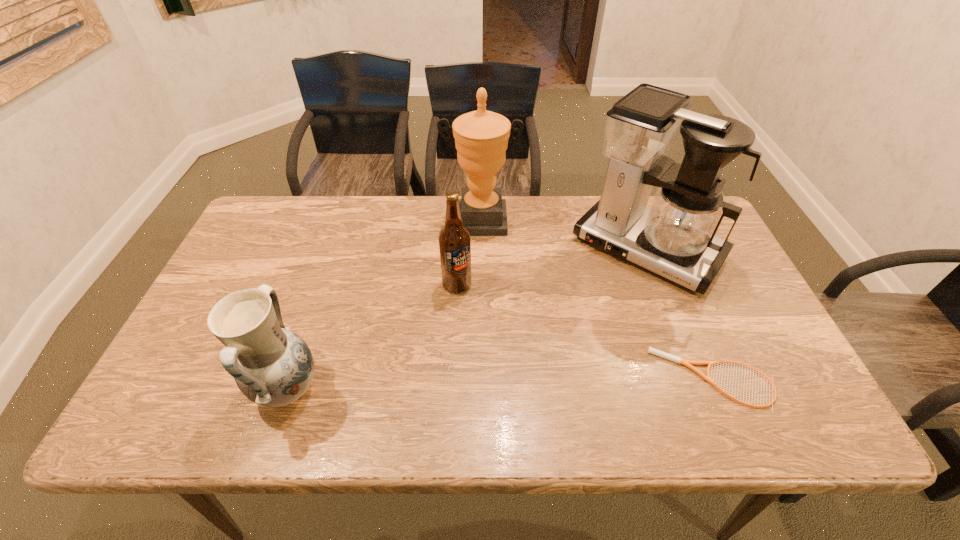
Where is `free spot located on the label of the beer bottle`? The image size is (960, 540). free spot located on the label of the beer bottle is located at coordinates (501, 369).

You are a GUI agent. You are given a task and a screenshot of the screen. Output one action in this format:
    pyautogui.click(x=<x>, y=<y>)
    Task: Click on the blank space located on the label of the beer bottle
    Image resolution: width=960 pixels, height=540 pixels.
    Given the screenshot: What is the action you would take?
    pyautogui.click(x=510, y=387)

What are the coordinates of `vacant space situated 0.250m on the label of the beer bottle` in the screenshot? It's located at (501, 369).

Identify the location of blank area located 0.330m at the front of the coffee maker where the controls are located. (545, 370).

You are a GUI agent. You are given a task and a screenshot of the screen. Output one action in this format:
    pyautogui.click(x=<x>, y=<y>)
    Task: Click on the vacant space located 0.200m at the front of the coffee maker where the controls are located
    This screenshot has width=960, height=540.
    Given the screenshot: What is the action you would take?
    pyautogui.click(x=574, y=335)

In order to click on free space located 0.350m at the front of the coffee maker where the controls are located in this screenshot , I will do `click(540, 376)`.

Find the location of `award located in the far edge section of the desktop`. award located in the far edge section of the desktop is located at coordinates (481, 137).

Where is `coffee maker that is at the far edge`? coffee maker that is at the far edge is located at coordinates (675, 238).

Locate an element on the screen. Image resolution: width=960 pixels, height=540 pixels. pottery at the near edge is located at coordinates 272,366.

Find the location of a particular element. tennis racket located at the near edge is located at coordinates (687, 363).